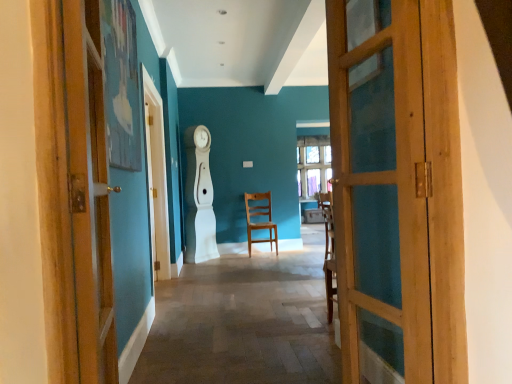
Question: From a real-world perspective, is wooden chair at center physically located above or below wooden door at left, positioned as the 2th door in right-to-left order?

Choices:
 (A) below
 (B) above

Answer: (A)

Question: Is wooden chair at center to the left or to the right of wooden door at left, positioned as the 2th door in right-to-left order, in the image?

Choices:
 (A) left
 (B) right

Answer: (B)

Question: Which object is positioned farthest from the wooden door at right, the 1th door viewed from the right?

Choices:
 (A) wooden chair at center
 (B) wooden door at left, positioned as the 2th door in right-to-left order

Answer: (A)

Question: Which is farther from the wooden door at left, the first door viewed from the left?

Choices:
 (A) wooden door at right, the 1th door viewed from the right
 (B) wooden chair at center

Answer: (B)